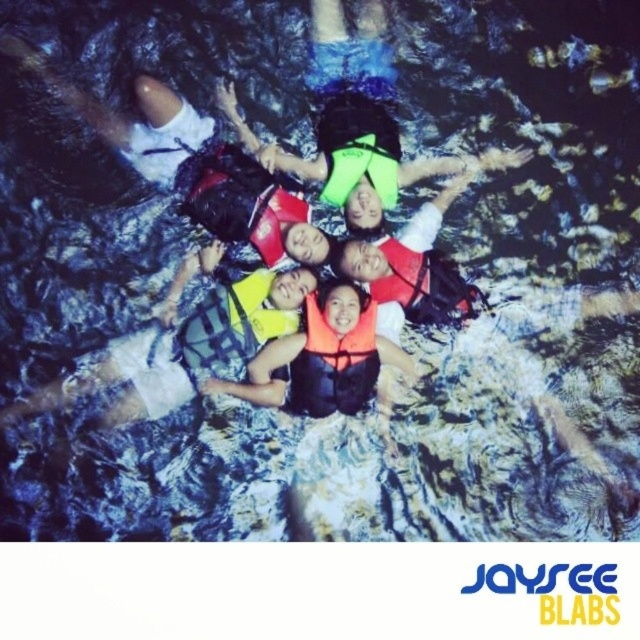
You are a photographer trying to capture the group of six individuals lying on their backs in a rocky, water filled area. You are standing at a position where you can see both point [244,304] and point [252,218]. Which point is closer to you?

Point [244,304] is closer to the viewer than point [252,218].

You are a photographer taking a group photo of the six people in the rocky water area. You notice the orange life vest at center and the neon yellow life jacket at center. To ensure both are visible in the frame, which direction should you move the camera slightly?

The orange life vest at center is to the right of neon yellow life jacket at center. To ensure both are visible, move the camera slightly to the right to include the orange life vest at center and keep the neon yellow life jacket at center in view.